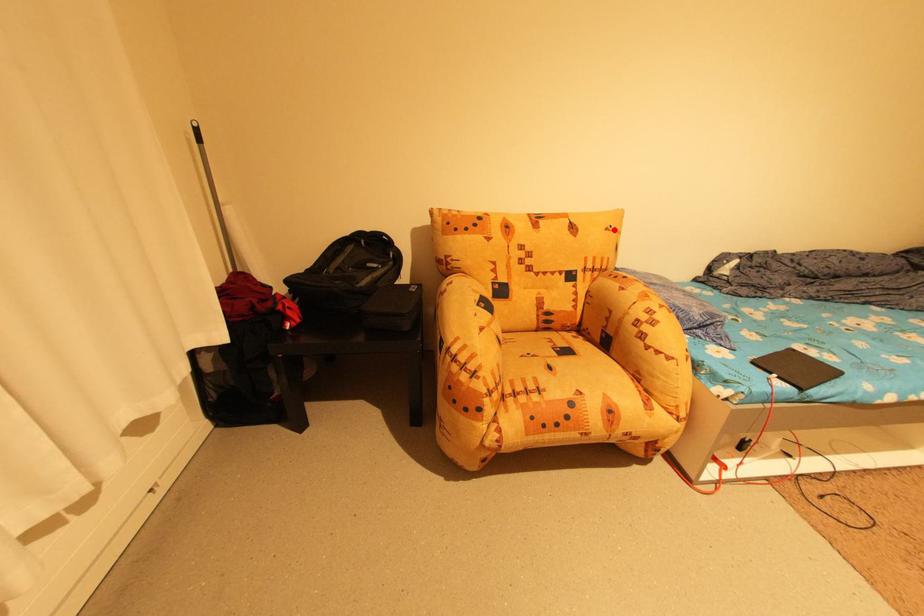
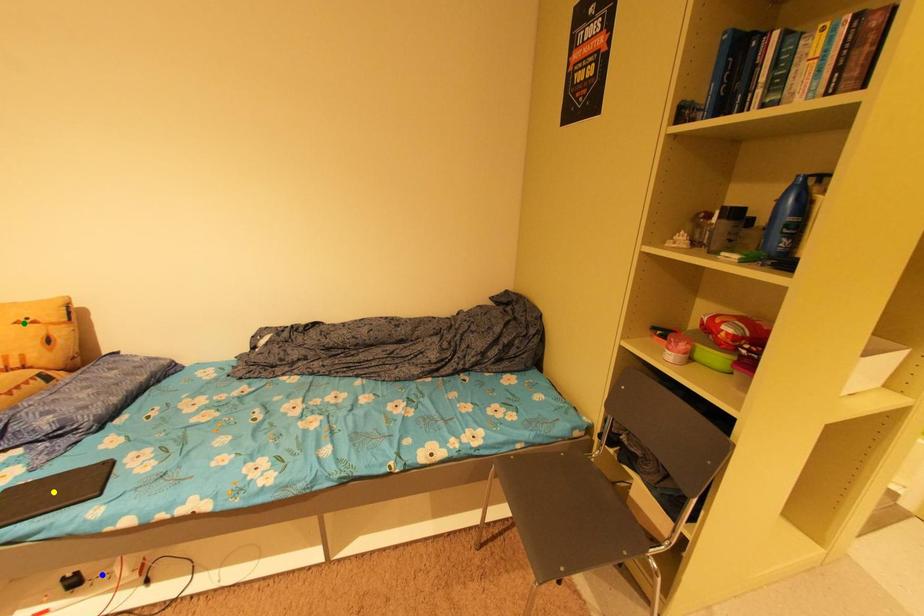
Question: I am providing you with two images of the same scene from different viewpoints. A red point is marked on the first image. You are given multiple points on the second image. Which mark in image 2 goes with the point in image 1?

Choices:
 (A) green point
 (B) yellow point
 (C) blue point

Answer: (A)